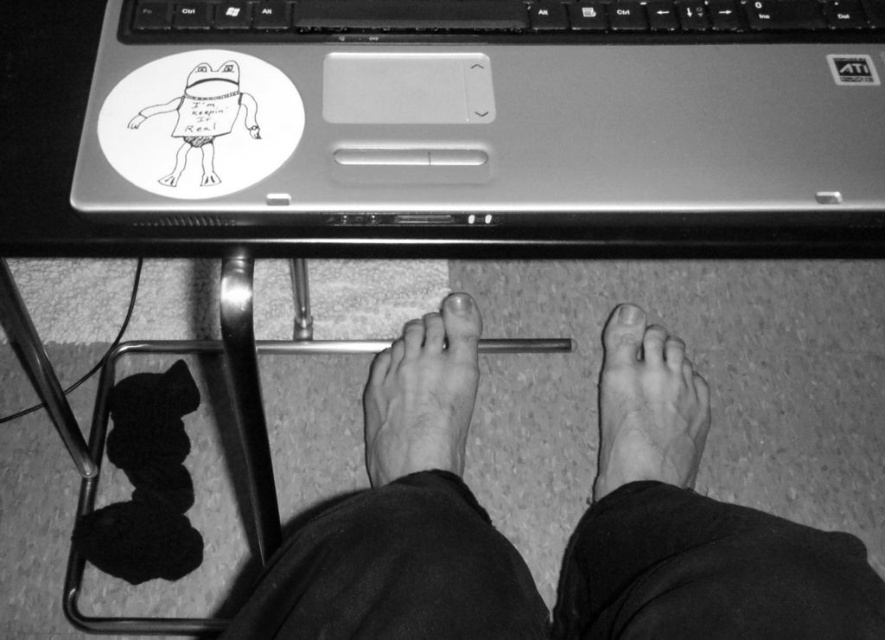
You are setting up a desk for a student who needs to place both the metallic silver laptop at upper center and the black plastic keyboard at upper center. Given that the laptop is taller than the keyboard, which object should be placed closer to the edge of the desk to ensure both fit comfortably?

The black plastic keyboard at upper center should be placed closer to the edge of the desk since the metallic silver laptop at upper center is taller and requires more space, allowing both to fit comfortably.

You are a photographer analyzing the composition of this image. Based on the spatial relationship between the hairless skin foot at lower center and the metallic silver sticker at upper right, which object occupies more vertical space in the frame?

The hairless skin foot at lower center occupies more vertical space in the frame as it is much taller than the metallic silver sticker at upper right.

Based on the scene description, where is the metallic silver laptop at upper center located in the image?

The metallic silver laptop at upper center is located at point coordinates of (482, 108).